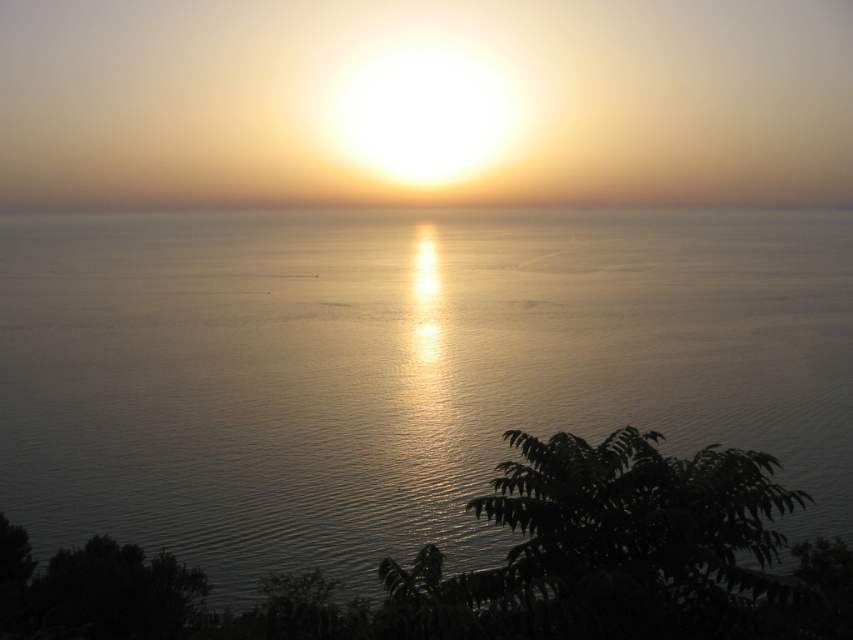
You are a photographer standing on the cliff overlooking the sea. You want to capture a photo of the silvery reflective water at center and the smooth sand horizon at center. How far apart are these two elements in your view?

The distance between the silvery reflective water at center and the smooth sand horizon at center is 139.96 meters.

From the picture: You are standing on the cliff overlooking the sunset. You notice the silvery reflective water at center and the smooth sand horizon at center. Which of these two features appears narrower in the scene?

The silvery reflective water at center appears narrower than the smooth sand horizon at center because it has a lesser width compared to it.